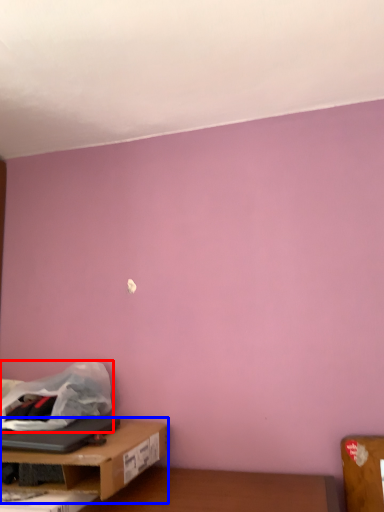
Question: Among these objects, which one is nearest to the camera, plastic bag (highlighted by a red box) or table (highlighted by a blue box)?

Choices:
 (A) plastic bag
 (B) table

Answer: (B)